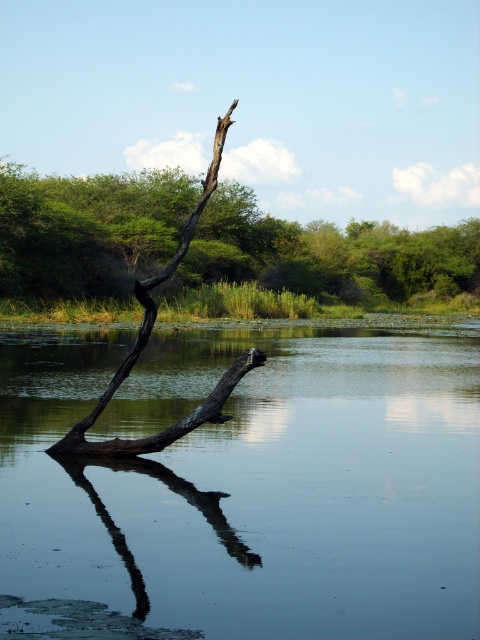
You are a hiker trying to cross the water using the dark brown wood at center and the smooth dark wood branch at lower center. Which one is wider and can support your weight better?

The dark brown wood at center is wider than the smooth dark wood branch at lower center, so it can support your weight better.

You are a hiker who wants to cross the water using the branches. You see the dark brown wood at center and the smooth dark wood branch at lower center. Which branch is positioned to the left when viewed from the shore?

The dark brown wood at center is positioned to the left of the smooth dark wood branch at lower center.